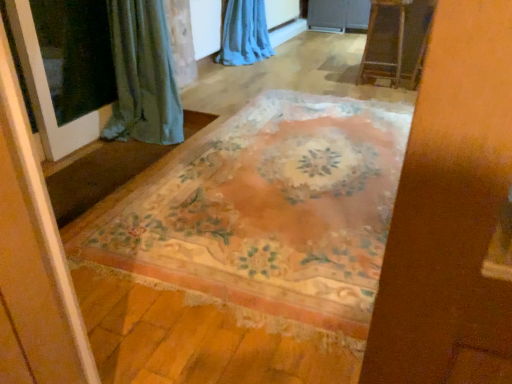
Question: From the image's perspective, is transparent glass screen door at left located above blue sheer curtain at upper center?

Choices:
 (A) yes
 (B) no

Answer: (B)

Question: From the image's perspective, is transparent glass screen door at left beneath blue sheer curtain at upper center?

Choices:
 (A) yes
 (B) no

Answer: (A)

Question: Considering the relative positions of transparent glass screen door at left and blue sheer curtain at upper center in the image provided, is transparent glass screen door at left to the right of blue sheer curtain at upper center from the viewer's perspective?

Choices:
 (A) no
 (B) yes

Answer: (A)

Question: Considering the relative positions of transparent glass screen door at left and blue sheer curtain at upper center in the image provided, is transparent glass screen door at left to the left of blue sheer curtain at upper center from the viewer's perspective?

Choices:
 (A) no
 (B) yes

Answer: (B)

Question: Does transparent glass screen door at left turn towards blue sheer curtain at upper center?

Choices:
 (A) yes
 (B) no

Answer: (B)

Question: In terms of size, does wooden ladder at upper right appear bigger or smaller than floral-patterned rug at center?

Choices:
 (A) big
 (B) small

Answer: (B)

Question: In terms of width, does wooden ladder at upper right look wider or thinner when compared to floral-patterned rug at center?

Choices:
 (A) wide
 (B) thin

Answer: (B)

Question: In the image, is wooden ladder at upper right positioned in front of or behind floral-patterned rug at center?

Choices:
 (A) behind
 (B) front

Answer: (A)

Question: Does point (399, 29) appear closer or farther from the camera than point (330, 163)?

Choices:
 (A) closer
 (B) farther

Answer: (B)

Question: Do you think wooden ladder at upper right is within blue sheer curtain at upper center, or outside of it?

Choices:
 (A) inside
 (B) outside

Answer: (B)

Question: From their relative heights in the image, would you say wooden ladder at upper right is taller or shorter than blue sheer curtain at upper center?

Choices:
 (A) tall
 (B) short

Answer: (A)

Question: Would you say wooden ladder at upper right is to the left or to the right of blue sheer curtain at upper center in the picture?

Choices:
 (A) left
 (B) right

Answer: (B)

Question: Looking at their shapes, would you say wooden ladder at upper right is wider or thinner than blue sheer curtain at upper center?

Choices:
 (A) thin
 (B) wide

Answer: (A)

Question: From a real-world perspective, is floral-patterned rug at center above or below wooden ladder at upper right?

Choices:
 (A) below
 (B) above

Answer: (A)

Question: From their relative heights in the image, would you say floral-patterned rug at center is taller or shorter than wooden ladder at upper right?

Choices:
 (A) short
 (B) tall

Answer: (A)